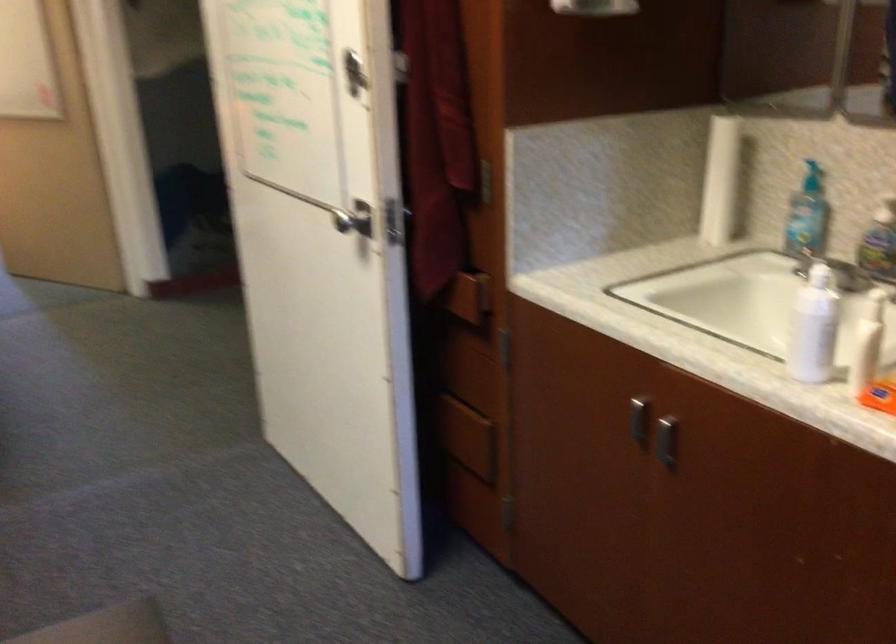
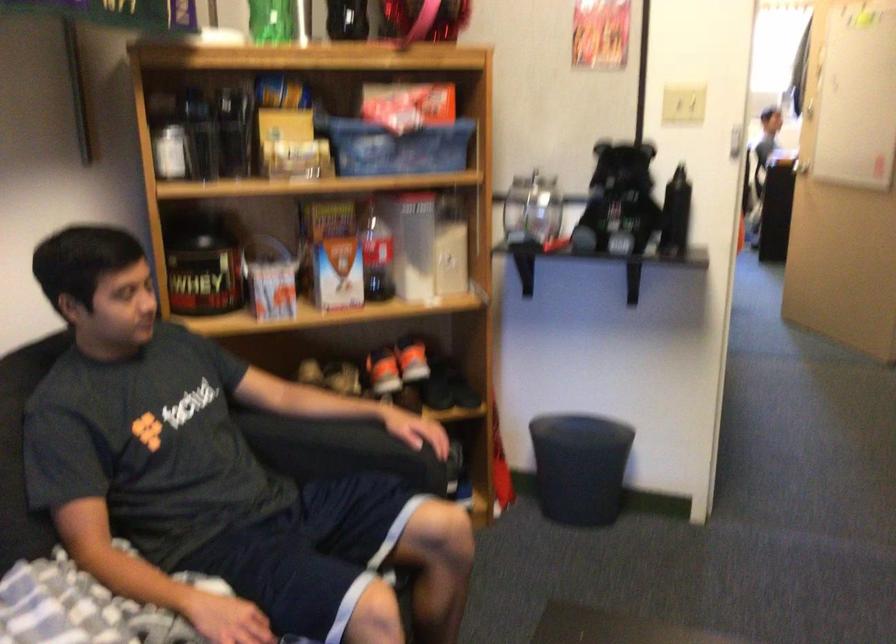
Question: The camera is either moving clockwise (left) or counter-clockwise (right) around the object. The first image is from the beginning of the video and the second image is from the end. Is the camera moving left or right when shooting the video?

Choices:
 (A) Left
 (B) Right

Answer: (B)